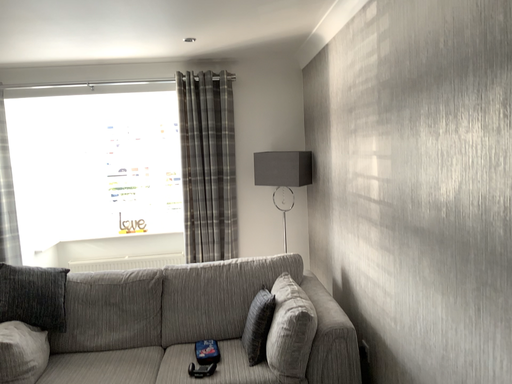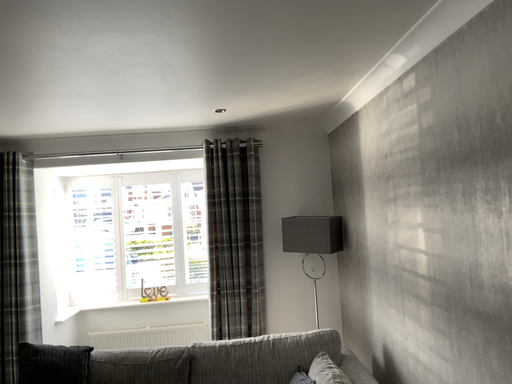
Question: Which way did the camera rotate in the video?

Choices:
 (A) rotated upward
 (B) rotated downward

Answer: (A)